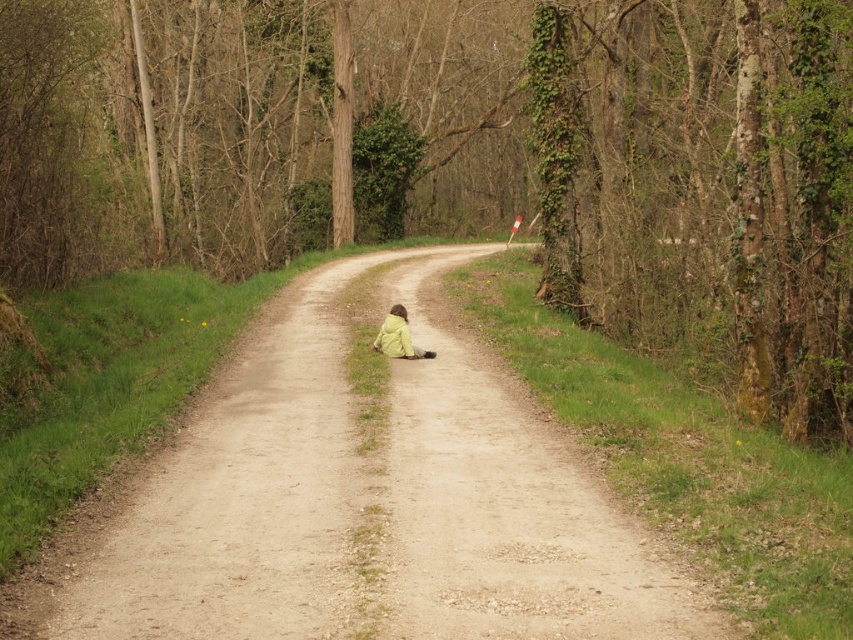
Which is more to the left, dirt road at center or yellow matte jacket at center?

From the viewer's perspective, dirt road at center appears more on the left side.

Between dirt road at center and yellow matte jacket at center, which one is positioned higher?

yellow matte jacket at center

Is point (326, 561) closer to camera compared to point (401, 339)?

Yes, point (326, 561) is closer to viewer.

The width and height of the screenshot is (853, 640). I want to click on dirt road at center, so click(361, 504).